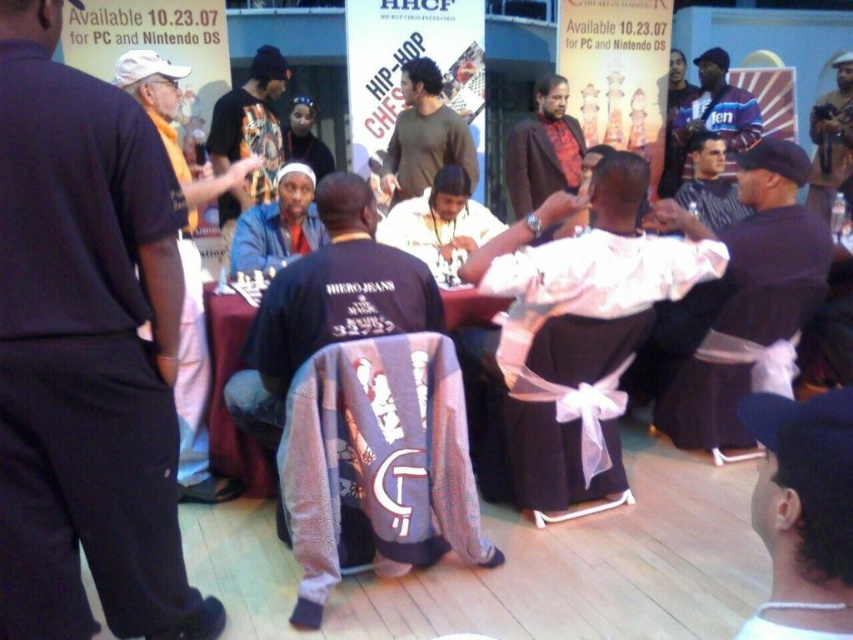
What are the coordinates of the brown textured suit at center in the image?

The brown textured suit at center is located at coordinates point (543, 148).

You are a photographer at the event and need to capture a closeup of both the brown textured suit at center and the matte blue shirt at center. Given that your camera has a minimum focusing distance of 6 feet, will you be able to take the photo without moving closer?

The distance between the brown textured suit at center and matte blue shirt at center is 6.17 feet. Since the minimum focusing distance is 6 feet, the photographer can capture both subjects in focus without moving closer.

You are standing at the entrance of the room and want to locate the person wearing the matte blue shirt at center. According to the chessboard coordinates, where should you look to find them?

The person wearing the matte blue shirt at center is located at the 2D coordinates point (x=277, y=225) relative to the chessboard.